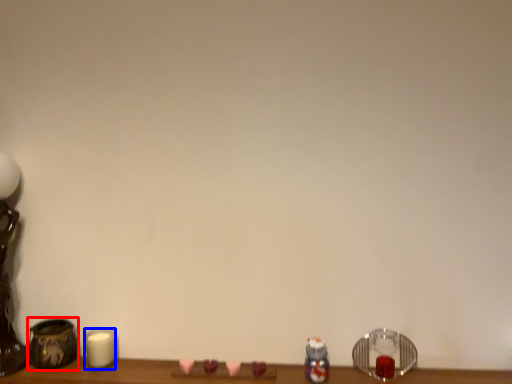
Question: Which point is closer to the camera, pottery (highlighted by a red box) or candle (highlighted by a blue box)?

Choices:
 (A) pottery
 (B) candle

Answer: (A)